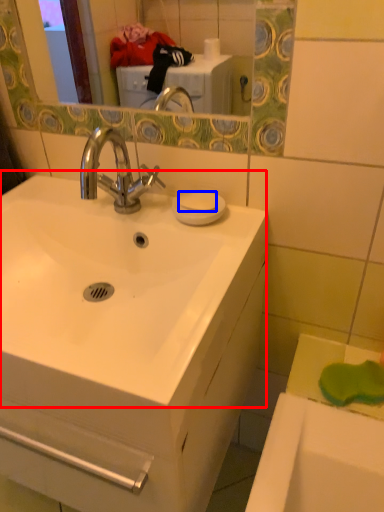
Question: Which object appears closest to the camera in this image, sink (highlighted by a red box) or soap (highlighted by a blue box)?

Choices:
 (A) sink
 (B) soap

Answer: (A)